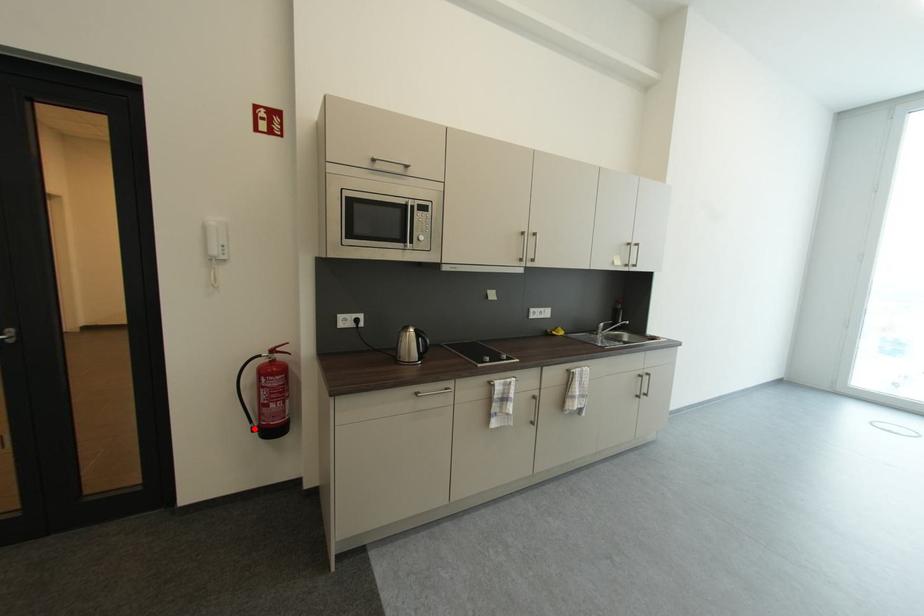
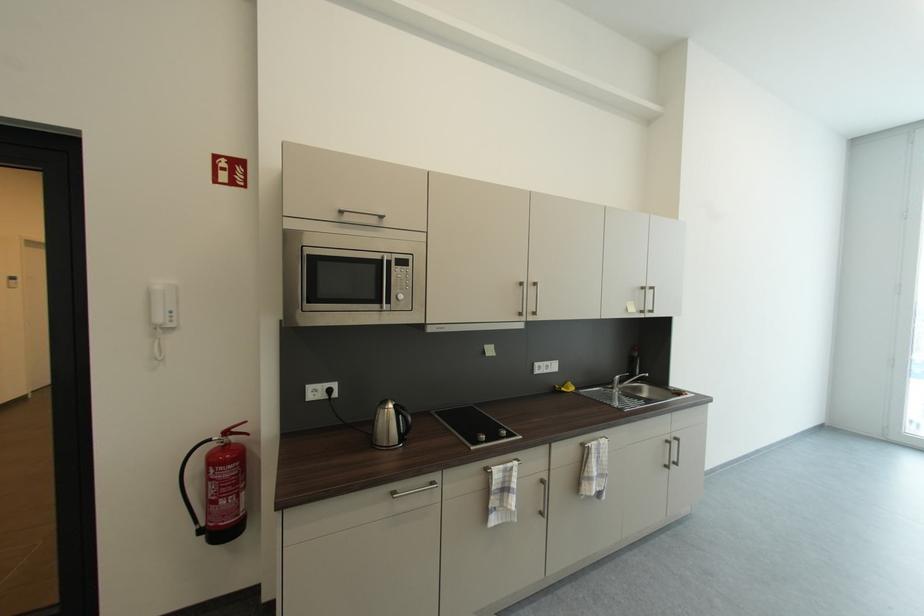
In the second image, find the point that corresponds to the highlighted location in the first image.

(199, 531)